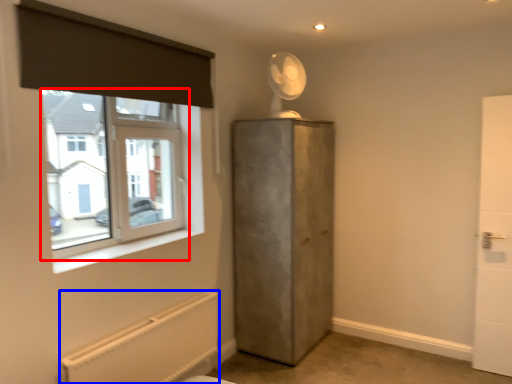
Question: Among these objects, which one is nearest to the camera, window (highlighted by a red box) or radiator (highlighted by a blue box)?

Choices:
 (A) window
 (B) radiator

Answer: (B)